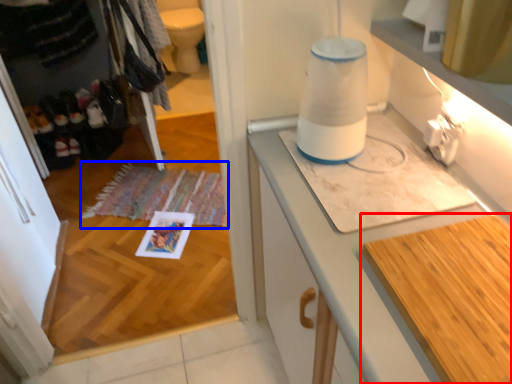
Question: Which object is closer to the camera taking this photo, countertop (highlighted by a red box) or mat (highlighted by a blue box)?

Choices:
 (A) countertop
 (B) mat

Answer: (A)